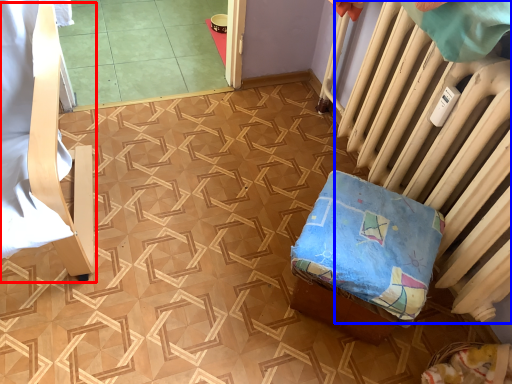
Question: Which point is further to the camera, furniture (highlighted by a red box) or radiator (highlighted by a blue box)?

Choices:
 (A) furniture
 (B) radiator

Answer: (B)